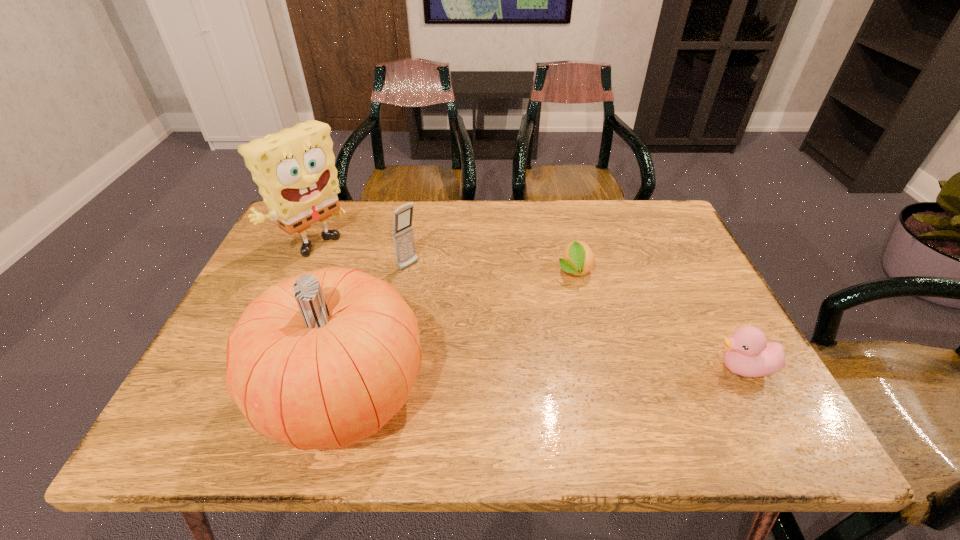
Where is `vacant space on the desktop that is between the pumpkin and the second shortest object and is positioned on the front-facing side of the third tallest object`? Image resolution: width=960 pixels, height=540 pixels. vacant space on the desktop that is between the pumpkin and the second shortest object and is positioned on the front-facing side of the third tallest object is located at coordinates (559, 380).

Locate an element on the screen. This screenshot has height=540, width=960. vacant space on the desktop that is between the pumpkin and the second shortest object and is positioned on the face of the sponge is located at coordinates (517, 383).

This screenshot has height=540, width=960. Find the location of `vacant space on the desktop that is between the pumpkin and the duckling and is positioned with leaves positioned above the shortest object`. vacant space on the desktop that is between the pumpkin and the duckling and is positioned with leaves positioned above the shortest object is located at coordinates (588, 378).